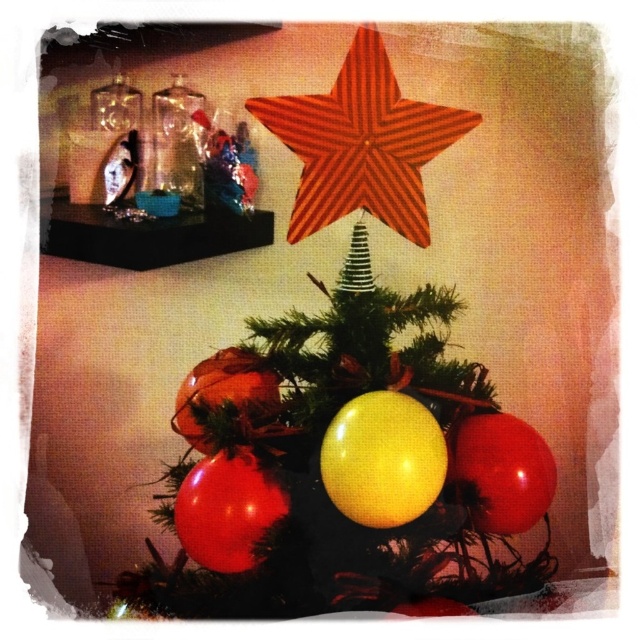
Question: Which object is positioned closest to the red striped star at upper center?

Choices:
 (A) glossy red balloon at center
 (B) shiny metallic ornament at center
 (C) matte red star at upper center
 (D) glossy red balloon at lower center

Answer: (C)

Question: Does yellow glossy balloon at center have a lesser width compared to glossy red balloon at center?

Choices:
 (A) no
 (B) yes

Answer: (A)

Question: Is matte red star at upper center bigger than red striped star at upper center?

Choices:
 (A) no
 (B) yes

Answer: (B)

Question: Which point appears farthest from the camera in this image?

Choices:
 (A) (218, 352)
 (B) (237, 536)
 (C) (266, 100)
 (D) (518, 484)

Answer: (A)

Question: Considering the real-world distances, which object is closest to the yellow glossy balloon at center?

Choices:
 (A) glossy red balloon at lower center
 (B) glossy red balloon at center
 (C) shiny metallic ornament at center

Answer: (B)

Question: Does red striped star at upper center have a lesser width compared to yellow glossy balloon at center?

Choices:
 (A) no
 (B) yes

Answer: (A)